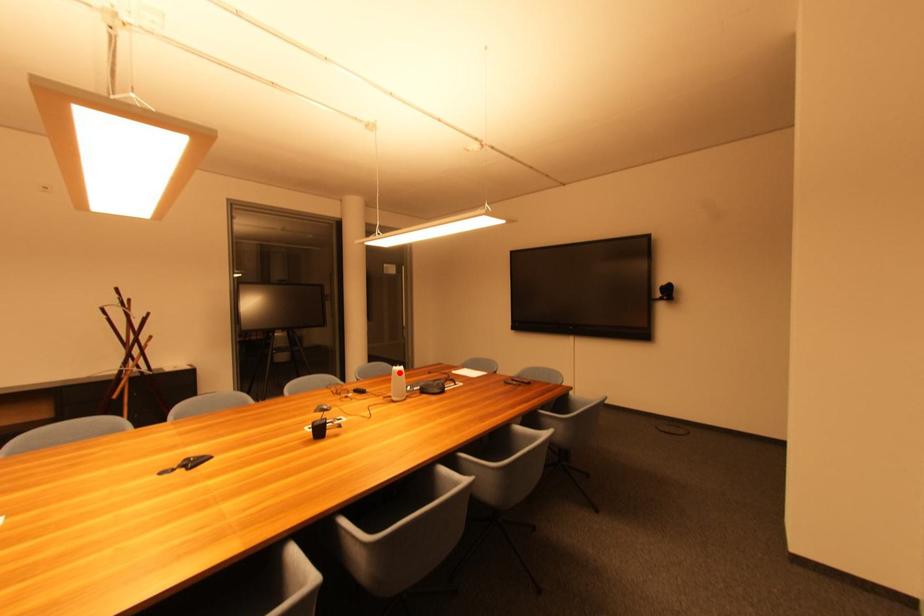
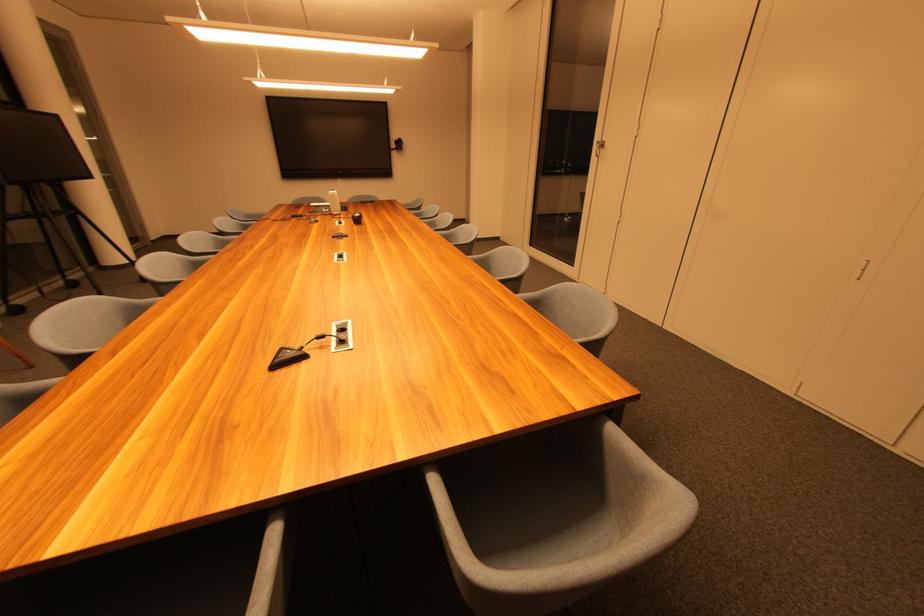
Question: I am providing you with two images of the same scene from different viewpoints. In image1, a red point is highlighted. Considering the same 3D point in image2, which of the following is correct?

Choices:
 (A) It is closer
 (B) It is farther

Answer: (B)